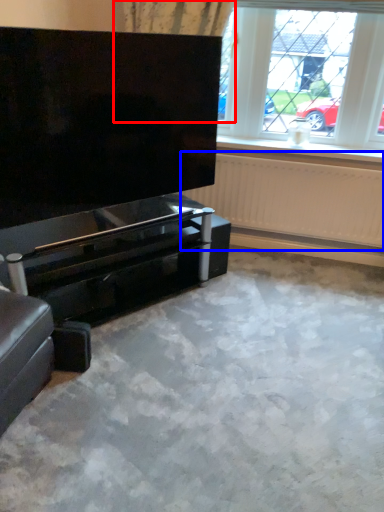
Question: Among these objects, which one is nearest to the camera, curtain (highlighted by a red box) or radiator (highlighted by a blue box)?

Choices:
 (A) curtain
 (B) radiator

Answer: (A)